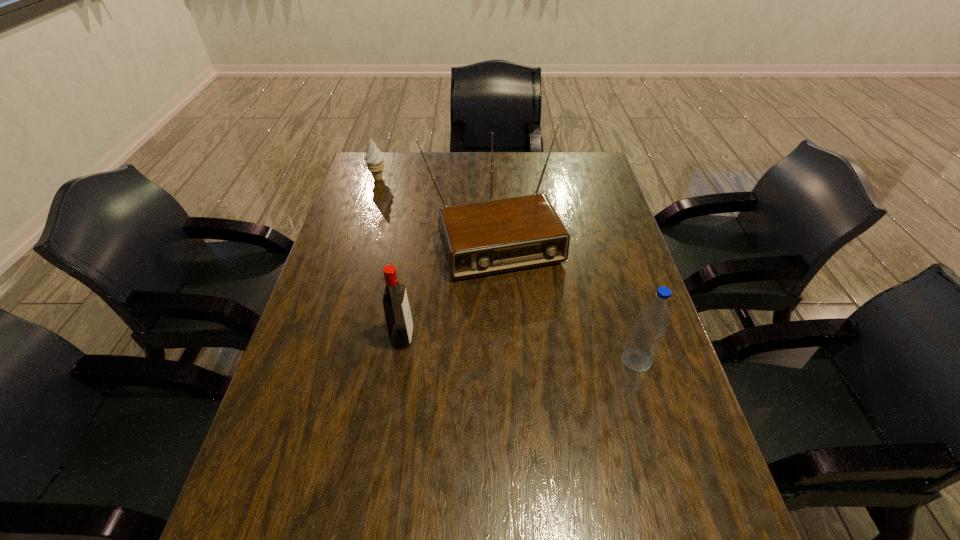
Locate an element on the screen. This screenshot has width=960, height=540. vodka is located at coordinates click(399, 322).

Identify the location of the rightmost object. The width and height of the screenshot is (960, 540). (644, 340).

Identify the location of the leftmost object. The image size is (960, 540). (374, 158).

At what (x,y) coordinates should I click in order to perform the action: click on the shortest object. Please return your answer as a coordinate pair (x, y). Looking at the image, I should click on (374, 158).

Where is `the tallest object`? The image size is (960, 540). the tallest object is located at coordinates (494, 236).

In order to click on the third nearest object in this screenshot , I will do `click(494, 236)`.

At what (x,y) coordinates should I click in order to perform the action: click on free region located on the front and back of the vodka. Please return your answer as a coordinate pair (x, y). The height and width of the screenshot is (540, 960). Looking at the image, I should click on (572, 338).

The image size is (960, 540). I want to click on free spot located 0.400m on the back of the rightmost object, so click(x=601, y=242).

Identify the location of vacant space situated on the front-facing side of the farthest object. This screenshot has height=540, width=960. point(397,205).

This screenshot has height=540, width=960. Identify the location of vacant space located 0.090m on the front-facing side of the farthest object. 391,196.